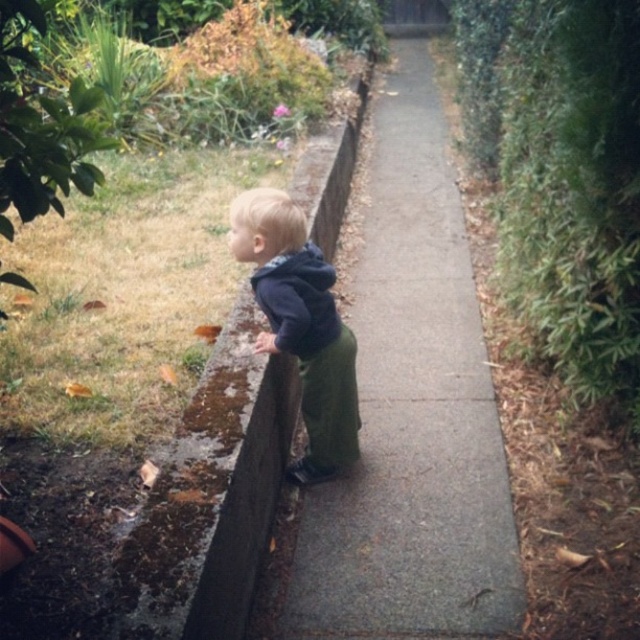
You are a delivery drone flying over a garden pathway. You need to land on the slate gray concrete at center to deliver a package. However, your landing gear is 1.2 meters tall. Can your landing gear touch the ground before the dark blue hoodie at center?

The slate gray concrete at center is taller than the dark blue hoodie at center. Since the landing gear is 1.2 meters tall, it will touch the slate gray concrete at center first before reaching the dark blue hoodie at center.